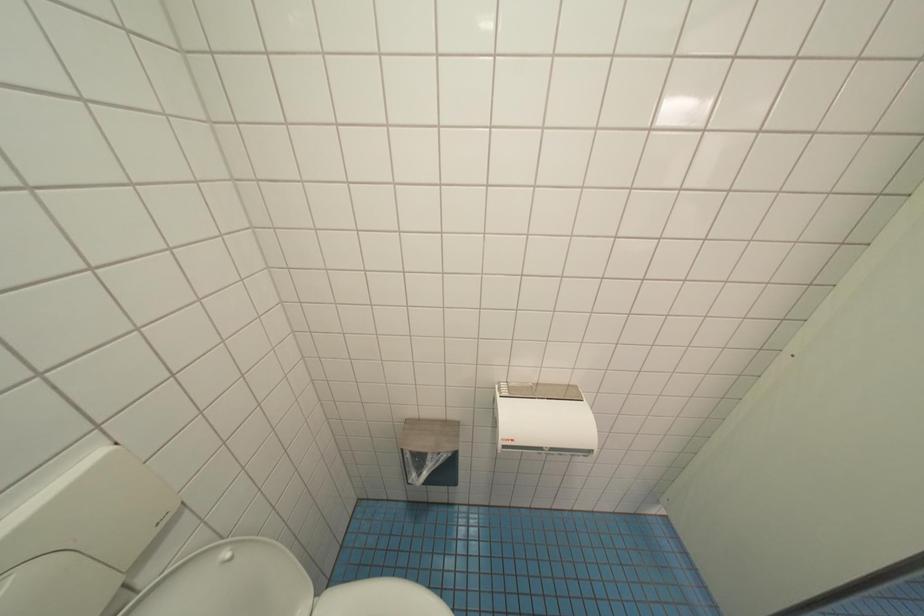
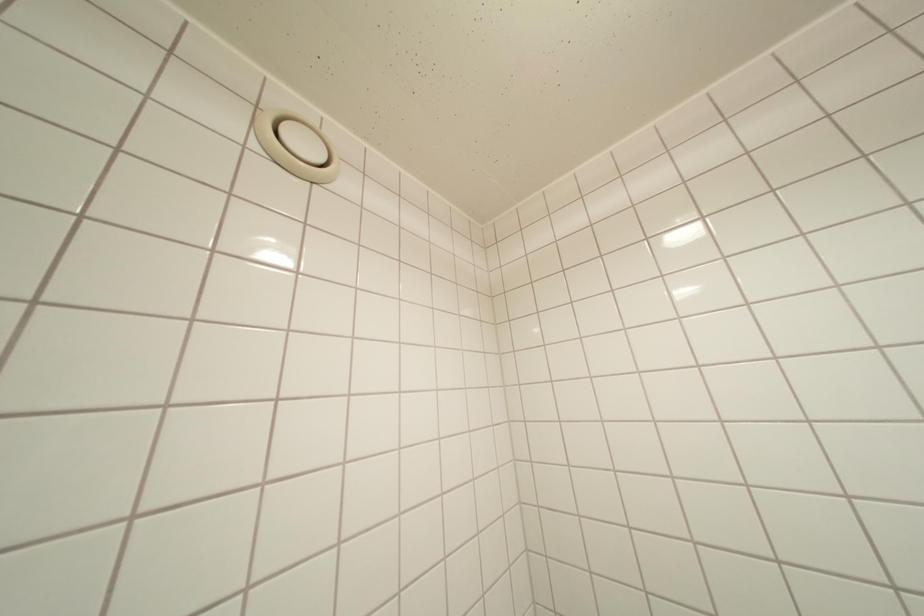
Based on the continuous images, in which direction is the camera rotating?

The camera rotated toward left-up.